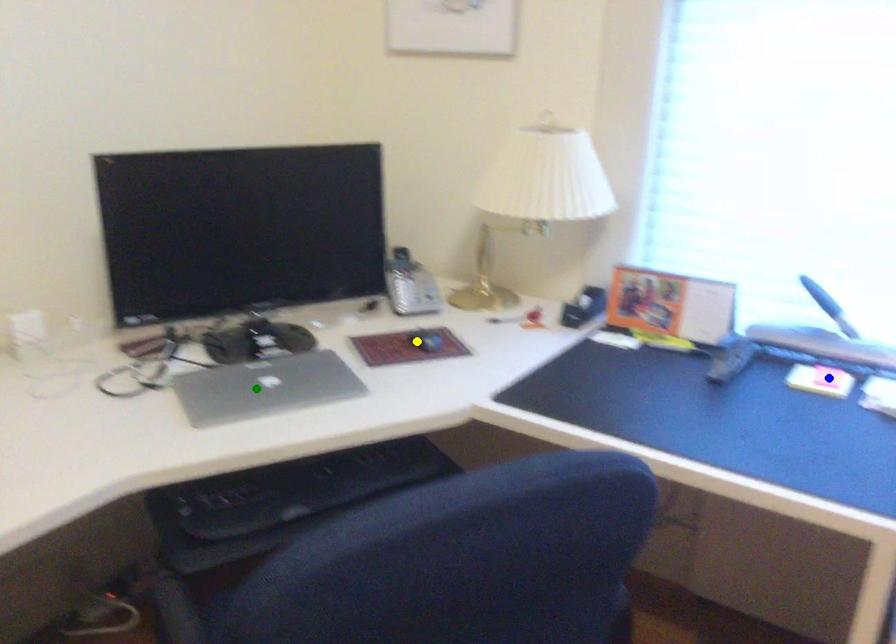
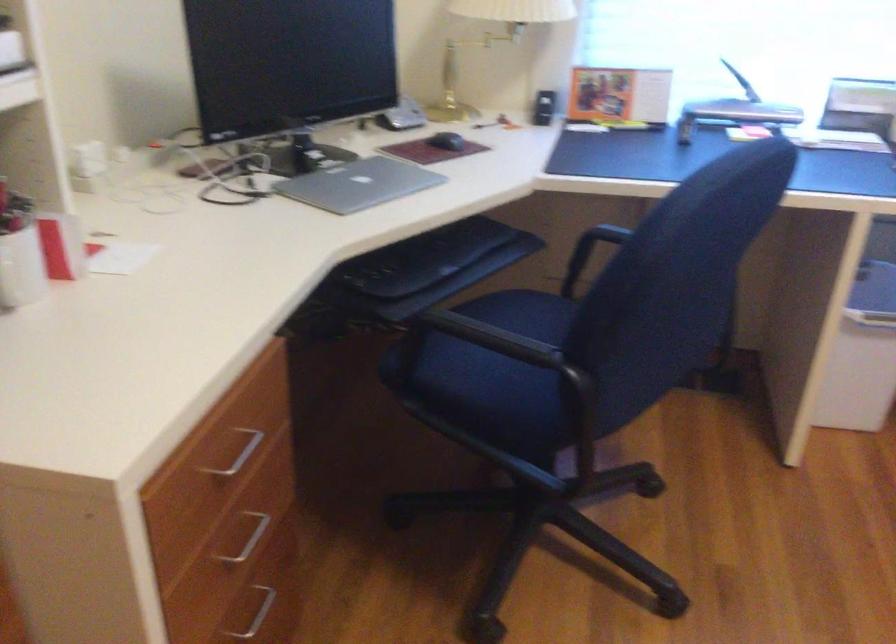
I am providing you with two images of the same scene from different viewpoints. Three points are marked in image1. Which point corresponds to a part or object that is occluded in image2?In image1, three points are marked. Which of them correspond to a part or object that is occluded in image2?Among the three points shown in image1, which one corresponds to a part or object that is no longer visible due to occlusion in image2?

Invisible in image2: blue point.